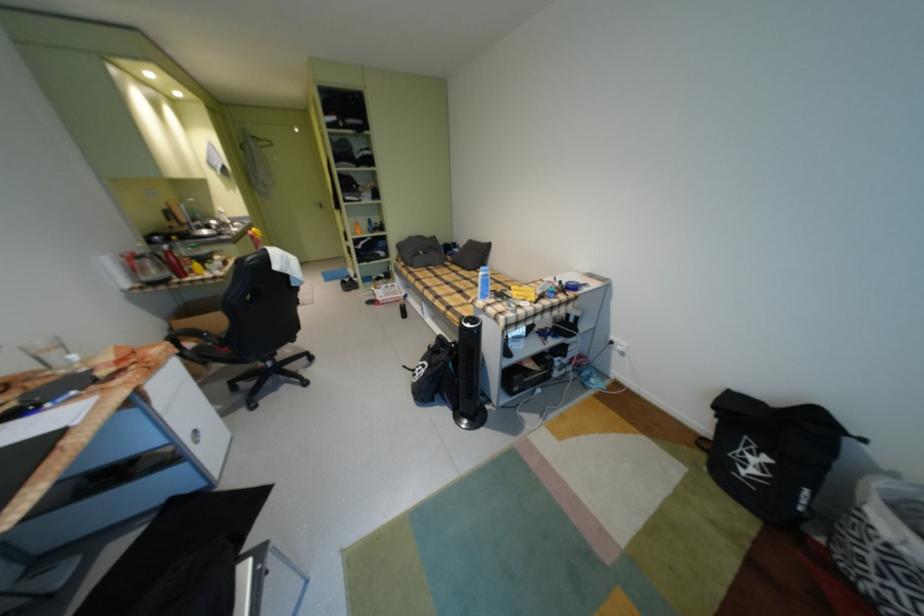
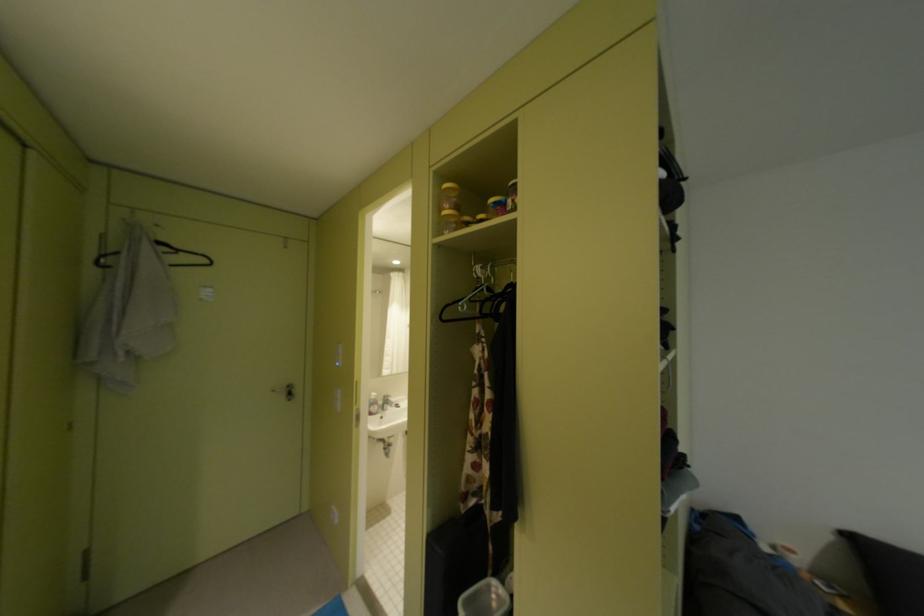
Where in the second image is the point corresponding to pixel 266 140 from the first image?

(175, 249)